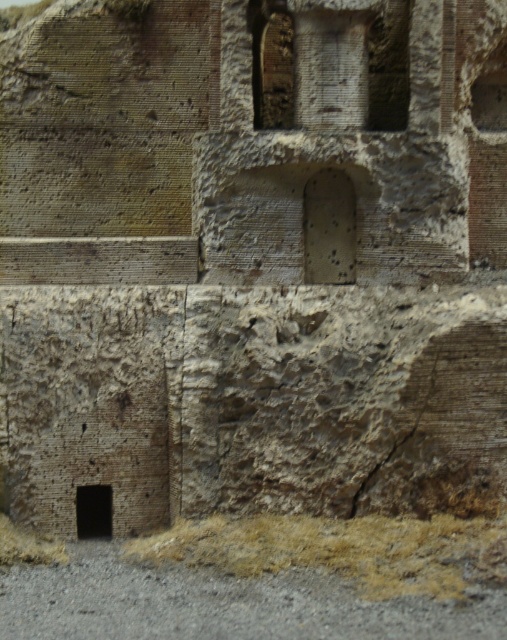
Question: Can you confirm if brown dry grass at lower center is positioned to the right of black stone hole at lower left?

Choices:
 (A) yes
 (B) no

Answer: (A)

Question: Which of the following is the closest to the observer?

Choices:
 (A) (306, 528)
 (B) (103, 531)

Answer: (A)

Question: Is brown dry grass at lower center to the right of black stone hole at lower left from the viewer's perspective?

Choices:
 (A) yes
 (B) no

Answer: (A)

Question: Which of the following is the farthest from the observer?

Choices:
 (A) brown dry grass at lower center
 (B) black stone hole at lower left

Answer: (B)

Question: Is brown dry grass at lower center closer to camera compared to black stone hole at lower left?

Choices:
 (A) no
 (B) yes

Answer: (B)

Question: Which object appears closest to the camera in this image?

Choices:
 (A) black stone hole at lower left
 (B) brown dry grass at lower center

Answer: (B)